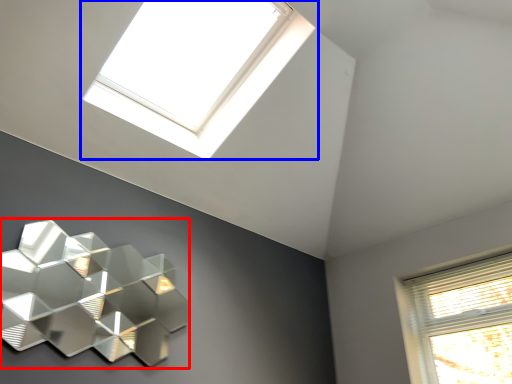
Question: Which point is further to the camera, lamp (highlighted by a red box) or window (highlighted by a blue box)?

Choices:
 (A) lamp
 (B) window

Answer: (B)